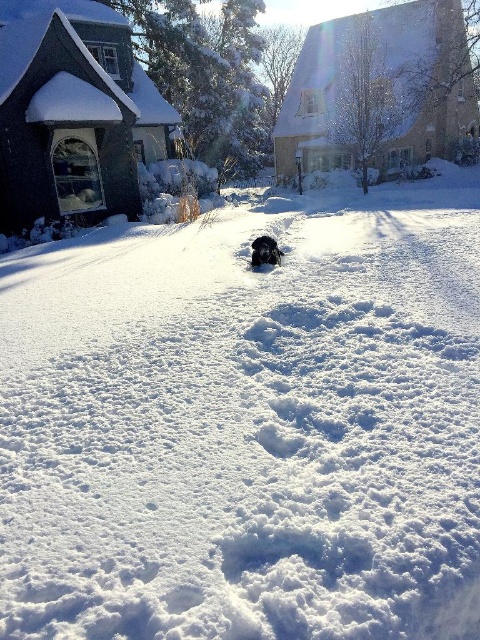
You are a photographer trying to capture the black fur dog at center in the snow. Since the dog is on the white fluffy snow at center, will the dog be easy to see against the snow?

The black fur dog at center is smaller than the white fluffy snow at center, so the dog will stand out against the snow and be easy to see.

From the picture: You are a photographer trying to capture the black fur dog at center in the snow. Since the white fluffy snow at center is covering part of the dog, will you need to adjust your camera settings to ensure the dog is visible?

The white fluffy snow at center is positioned over black fur dog at center, so adjusting the camera settings may be necessary to avoid overexposure from the snow and ensure the dog remains visible.

You are standing at the center of the image and want to place a small red flag exactly where the white fluffy snow at center is located. What are the coordinates where you should place the flag?

You should place the small red flag at coordinates point (247, 422) where the white fluffy snow at center is located.